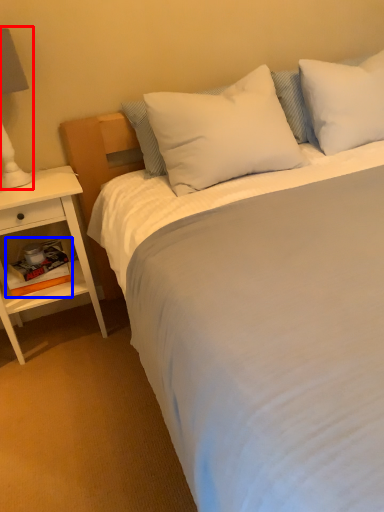
Question: Among these objects, which one is nearest to the camera, bedside lamp (highlighted by a red box) or book (highlighted by a blue box)?

Choices:
 (A) bedside lamp
 (B) book

Answer: (A)